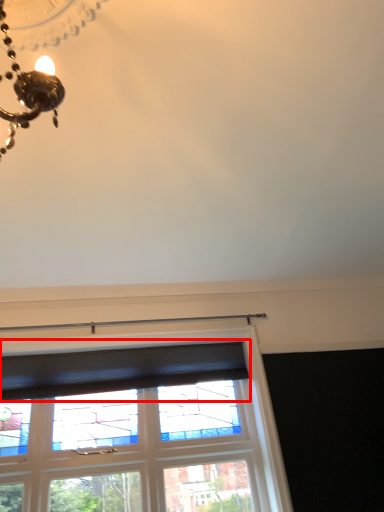
Question: Considering the relative positions of curtain (annotated by the red box) and window in the image provided, where is curtain (annotated by the red box) located with respect to the staircase?

Choices:
 (A) left
 (B) right

Answer: (A)